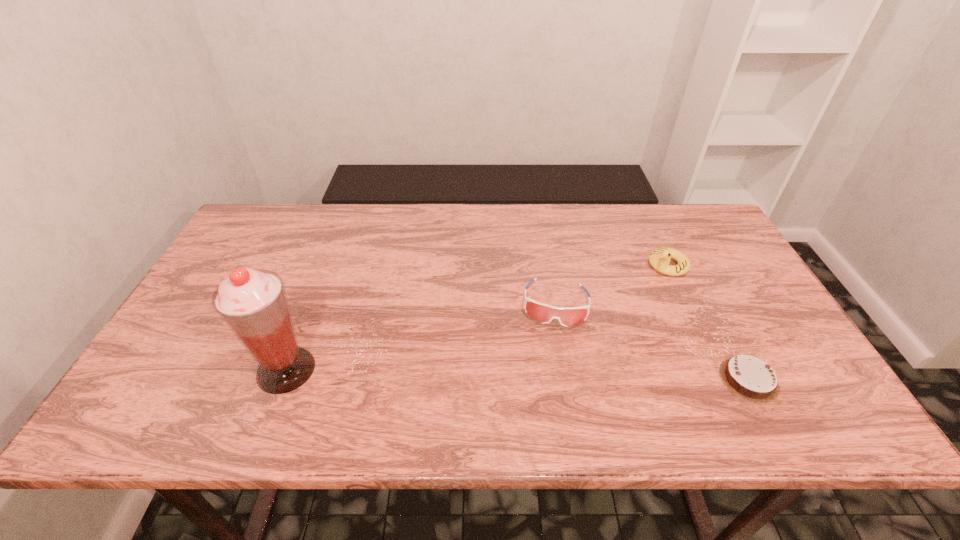
The image size is (960, 540). In the image, there is a desktop. What are the coordinates of `vacant space at the left edge` in the screenshot? It's located at (207, 319).

What are the coordinates of `vacant space at the right edge` in the screenshot? It's located at (716, 263).

Identify the location of vacant space at the far left corner of the desktop. (275, 246).

Image resolution: width=960 pixels, height=540 pixels. In order to click on free location at the near left corner in this screenshot , I will do `click(176, 376)`.

Find the location of `empty space that is in between the duckling and the third nearest object`. empty space that is in between the duckling and the third nearest object is located at coordinates (612, 284).

Where is `vacant area that lies between the duckling and the second object from left to right`? The image size is (960, 540). vacant area that lies between the duckling and the second object from left to right is located at coordinates 612,284.

Find the location of a particular element. This screenshot has width=960, height=540. vacant area that lies between the chocolate cake and the third nearest object is located at coordinates (652, 342).

You are a GUI agent. You are given a task and a screenshot of the screen. Output one action in this format:
    pyautogui.click(x=<x>, y=<y>)
    Task: Click on the vacant space that's between the second farthest object and the smoothie
    This screenshot has height=540, width=960.
    Given the screenshot: What is the action you would take?
    pyautogui.click(x=420, y=336)

This screenshot has width=960, height=540. I want to click on free area in between the shortest object and the second object from left to right, so (652, 342).

Where is `free spot between the third nearest object and the shortest object`? free spot between the third nearest object and the shortest object is located at coordinates (652, 342).